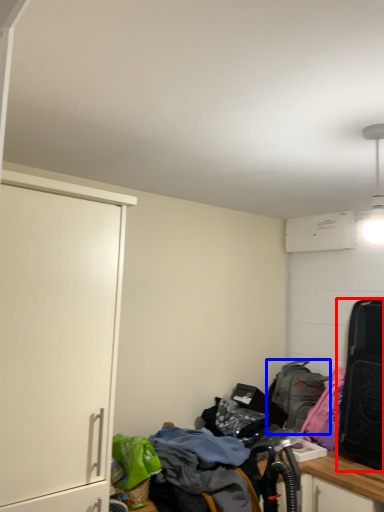
Question: Which object appears closest to the camera in this image, luggage and bags (highlighted by a red box) or backpack (highlighted by a blue box)?

Choices:
 (A) luggage and bags
 (B) backpack

Answer: (A)